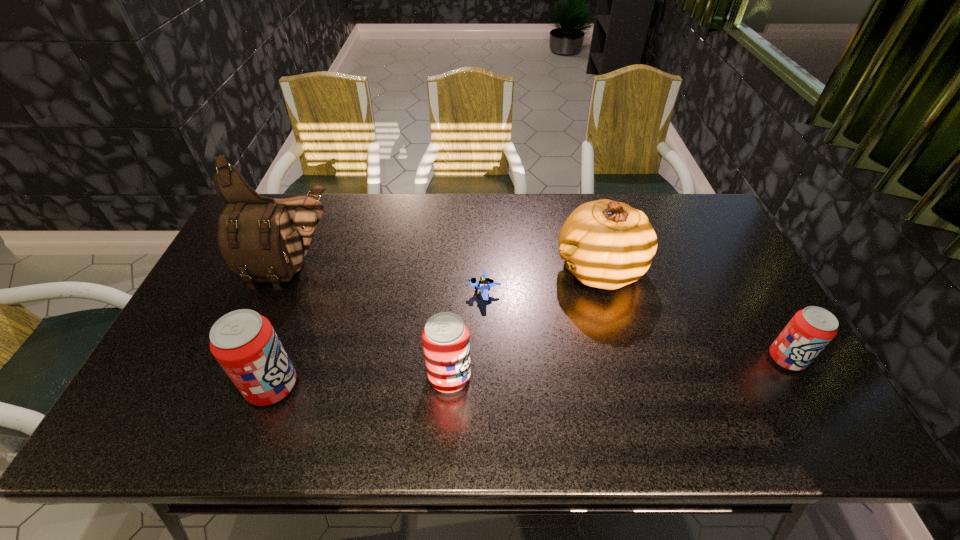
Where is `vacant area at the far edge`? This screenshot has height=540, width=960. vacant area at the far edge is located at coordinates (537, 224).

At what (x,y) coordinates should I click in order to perform the action: click on vacant region at the near edge of the desktop. Please return your answer as a coordinate pair (x, y). Looking at the image, I should click on (708, 390).

Where is `vacant space at the left edge`? The height and width of the screenshot is (540, 960). vacant space at the left edge is located at coordinates [x=211, y=282].

The width and height of the screenshot is (960, 540). Find the location of `free space at the right edge of the desktop`. free space at the right edge of the desktop is located at coordinates (728, 353).

The image size is (960, 540). I want to click on free space at the near left corner of the desktop, so click(201, 386).

Where is `free space at the far right corner of the desktop`? free space at the far right corner of the desktop is located at coordinates (694, 222).

Locate an element on the screen. free point between the second soda can from left to right and the pumpkin is located at coordinates (524, 323).

The image size is (960, 540). Find the location of `free space that is in between the shoulder bag and the leftmost soda can`. free space that is in between the shoulder bag and the leftmost soda can is located at coordinates (283, 328).

What are the coordinates of `vacant area that lies between the pumpkin and the shortest object` in the screenshot? It's located at (542, 281).

Image resolution: width=960 pixels, height=540 pixels. I want to click on vacant area between the leftmost soda can and the second tallest soda can, so click(361, 381).